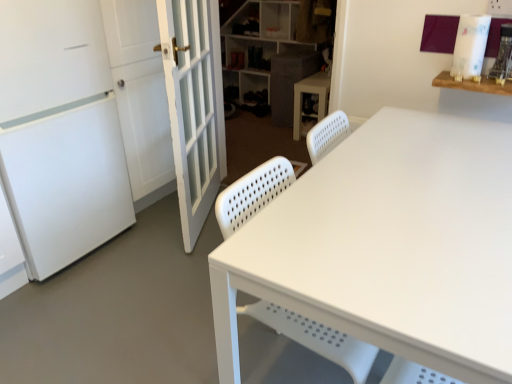
The image size is (512, 384). What do you see at coordinates (194, 105) in the screenshot?
I see `white glass door at left` at bounding box center [194, 105].

Measure the distance between white matte screen door at left and camera.

white matte screen door at left is 1.51 meters from camera.

The width and height of the screenshot is (512, 384). Describe the element at coordinates (271, 52) in the screenshot. I see `white plastic shelf at upper center` at that location.

Measure the distance between white plastic shelf at upper center and camera.

The distance of white plastic shelf at upper center from camera is 3.12 meters.

Measure the distance between point (304, 91) and camera.

A distance of 10.87 feet exists between point (304, 91) and camera.

I want to click on white glass door at left, so click(x=194, y=105).

Is textured gray cabinet at center positioned far away from wooden shelf at upper right?

Yes, textured gray cabinet at center and wooden shelf at upper right are quite far apart.

Based on the photo, how different are the orientations of textured gray cabinet at center and wooden shelf at upper right in degrees?

The facing directions of textured gray cabinet at center and wooden shelf at upper right are 89.9 degrees apart.

Is the depth of textured gray cabinet at center greater than that of wooden shelf at upper right?

That is True.

Measure the distance from textured gray cabinet at center to wooden shelf at upper right.

They are 6.09 feet apart.

From the image's perspective, is wooden shelf at upper right above or below white plastic cabinet at center?

Clearly, from the image's perspective, wooden shelf at upper right is below white plastic cabinet at center.

Who is shorter, wooden shelf at upper right or white plastic cabinet at center?

wooden shelf at upper right is shorter.

Does white matte screen door at left have a greater height compared to white perforated plastic swivel chair at center?

Yes, white matte screen door at left is taller than white perforated plastic swivel chair at center.

Visually, is white matte screen door at left positioned to the left or to the right of white perforated plastic swivel chair at center?

Clearly, white matte screen door at left is on the left of white perforated plastic swivel chair at center in the image.

Is white matte screen door at left completely or partially outside of white perforated plastic swivel chair at center?

Yes, white matte screen door at left is located beyond the bounds of white perforated plastic swivel chair at center.

Can you tell me how much white plastic cabinet at center and white matte screen door at left differ in facing direction?

90 degrees separate the facing orientations of white plastic cabinet at center and white matte screen door at left.

Is point (312, 79) closer to camera compared to point (95, 216)?

No, it is behind (95, 216).

Is white plastic cabinet at center not near white matte screen door at left?

white plastic cabinet at center is positioned a significant distance from white matte screen door at left.

Does white plastic cabinet at center come in front of white matte screen door at left?

No.

From the image's perspective, which is above, textured gray cabinet at center or white perforated plastic swivel chair at center?

textured gray cabinet at center appears higher in the image.

Which is in front, point (309, 72) or point (346, 366)?

The point (346, 366) is more forward.

What's the angular difference between textured gray cabinet at center and white perforated plastic swivel chair at center's facing directions?

179 degrees.

Considering the relative sizes of textured gray cabinet at center and white perforated plastic swivel chair at center in the image provided, is textured gray cabinet at center smaller than white perforated plastic swivel chair at center?

Yes, textured gray cabinet at center is smaller than white perforated plastic swivel chair at center.

Is white plastic shelf at upper center positioned with its back to white glass door at left?

white plastic shelf at upper center is not turned away from white glass door at left.

Is white plastic shelf at upper center wider than white glass door at left?

Indeed, white plastic shelf at upper center has a greater width compared to white glass door at left.

Which of these two, white plastic shelf at upper center or white glass door at left, stands shorter?

white plastic shelf at upper center is shorter.

How different are the orientations of white plastic shelf at upper center and white glass door at left in degrees?

The angular difference between white plastic shelf at upper center and white glass door at left is 114 degrees.

Considering the relative sizes of white perforated plastic swivel chair at center and white plastic cabinet at center in the image provided, is white perforated plastic swivel chair at center wider than white plastic cabinet at center?

Yes, white perforated plastic swivel chair at center is wider than white plastic cabinet at center.

From a real-world perspective, is white perforated plastic swivel chair at center below white plastic cabinet at center?

No.

Can you see white perforated plastic swivel chair at center touching white plastic cabinet at center?

No, white perforated plastic swivel chair at center is not touching white plastic cabinet at center.

From the image's perspective, does white perforated plastic swivel chair at center appear lower than white plastic cabinet at center?

Yes, from the image's perspective, white perforated plastic swivel chair at center is below white plastic cabinet at center.

The height and width of the screenshot is (384, 512). In order to click on table on the right of textured gray cabinet at center in this screenshot , I will do `click(472, 84)`.

Identify the location of table that appears above the white plastic cabinet at center (from a real-world perspective). (472, 84).

Consider the image. Which object lies further to the anchor point white matte screen door at left, white plastic shelf at upper center or white perforated plastic swivel chair at center?

white plastic shelf at upper center is further to white matte screen door at left.

Considering their positions, is textured gray cabinet at center positioned further to white glass door at left than white perforated plastic swivel chair at center?

textured gray cabinet at center.

Based on their spatial positions, is white glass door at left or white plastic cabinet at center further from wooden shelf at upper right?

white plastic cabinet at center lies further to wooden shelf at upper right than the other object.

Based on their spatial positions, is white matte screen door at left or wooden shelf at upper right closer to white plastic shelf at upper center?

white matte screen door at left lies closer to white plastic shelf at upper center than the other object.

Considering their positions, is white matte screen door at left positioned closer to white plastic cabinet at center than textured gray cabinet at center?

textured gray cabinet at center lies closer to white plastic cabinet at center than the other object.

From the image, which object appears to be farther from wooden shelf at upper right, white plastic shelf at upper center or white plastic cabinet at center?

Among the two, white plastic shelf at upper center is located further to wooden shelf at upper right.

When comparing their distances from white plastic shelf at upper center, does white plastic cabinet at center or white perforated plastic swivel chair at center seem further?

white perforated plastic swivel chair at center is further to white plastic shelf at upper center.

Considering their positions, is white plastic shelf at upper center positioned closer to white perforated plastic swivel chair at center than wooden shelf at upper right?

The object closer to white perforated plastic swivel chair at center is wooden shelf at upper right.

Where is `table between white perforated plastic swivel chair at center and textured gray cabinet at center in the front-back direction`? The width and height of the screenshot is (512, 384). table between white perforated plastic swivel chair at center and textured gray cabinet at center in the front-back direction is located at coordinates (472, 84).

At what (x,y) coordinates should I click in order to perform the action: click on cabinetry between white matte screen door at left and white plastic shelf at upper center along the z-axis. Please return your answer as a coordinate pair (x, y). This screenshot has height=384, width=512. Looking at the image, I should click on (289, 81).

This screenshot has width=512, height=384. Find the location of `cabinetry between white plastic shelf at upper center and white plastic cabinet at center from top to bottom`. cabinetry between white plastic shelf at upper center and white plastic cabinet at center from top to bottom is located at coordinates (289, 81).

Locate an element on the screen. Image resolution: width=512 pixels, height=384 pixels. swivel chair between white glass door at left and wooden shelf at upper right from left to right is located at coordinates [x=316, y=338].